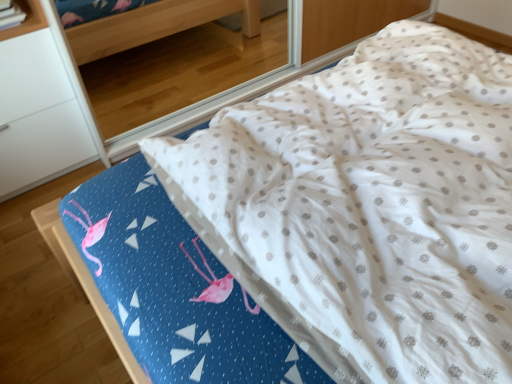
Question: Is white matte shelf at upper left bigger or smaller than white matte cabinet at left?

Choices:
 (A) big
 (B) small

Answer: (B)

Question: Is white matte shelf at upper left inside or outside of white matte cabinet at left?

Choices:
 (A) outside
 (B) inside

Answer: (A)

Question: Considering the positions of white matte shelf at upper left and white matte cabinet at left in the image, is white matte shelf at upper left taller or shorter than white matte cabinet at left?

Choices:
 (A) short
 (B) tall

Answer: (A)

Question: Would you say white matte cabinet at left is to the left or to the right of white matte shelf at upper left in the picture?

Choices:
 (A) right
 (B) left

Answer: (B)

Question: Is white matte cabinet at left wider or thinner than white matte shelf at upper left?

Choices:
 (A) thin
 (B) wide

Answer: (B)

Question: From their relative heights in the image, would you say white matte cabinet at left is taller or shorter than white matte shelf at upper left?

Choices:
 (A) short
 (B) tall

Answer: (B)

Question: From the image's perspective, is white matte cabinet at left positioned above or below white matte shelf at upper left?

Choices:
 (A) above
 (B) below

Answer: (B)